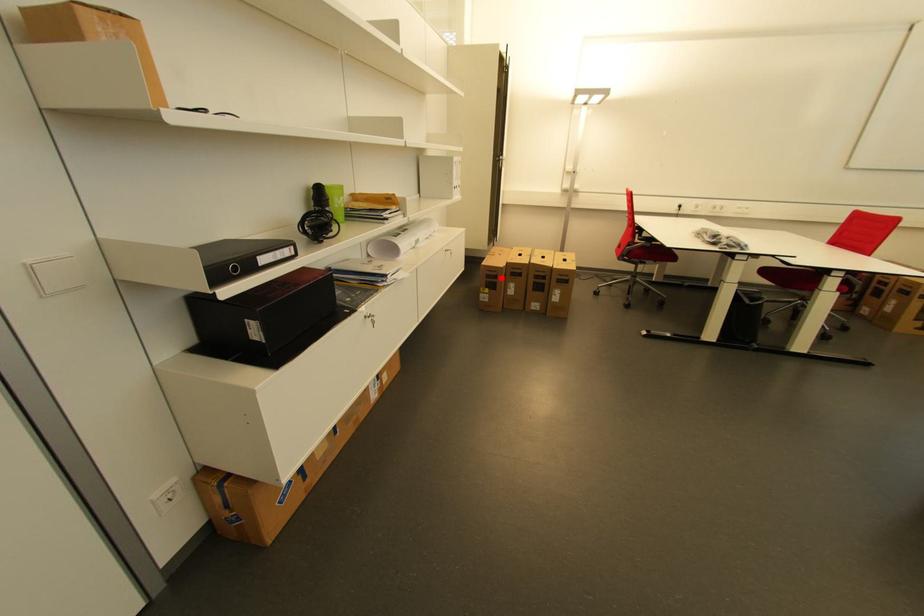
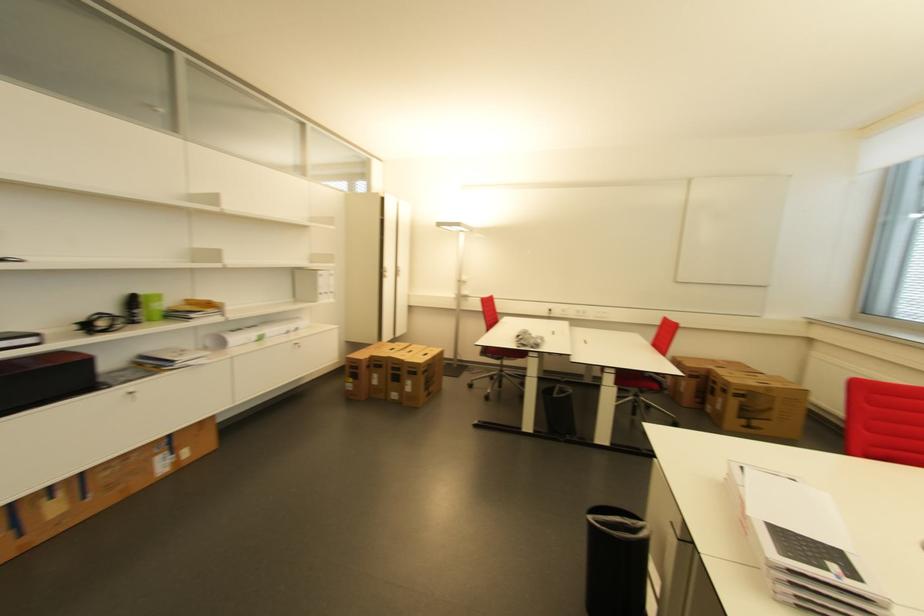
Question: A red point is marked in image1. In image2, is the corresponding 3D point closer to the camera or farther? Reply with the corresponding letter.

Choices:
 (A) The corresponding 3D point is closer.
 (B) The corresponding 3D point is farther.

Answer: (B)